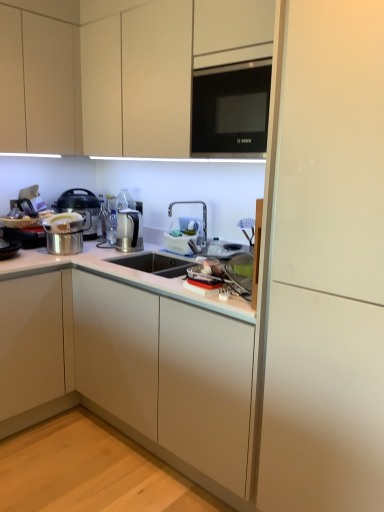
Question: Is white plastic basket at center to the right of black glass microwave at upper center from the viewer's perspective?

Choices:
 (A) no
 (B) yes

Answer: (A)

Question: Does white plastic basket at center have a smaller size compared to black glass microwave at upper center?

Choices:
 (A) yes
 (B) no

Answer: (A)

Question: From the image's perspective, is white plastic basket at center on top of black glass microwave at upper center?

Choices:
 (A) no
 (B) yes

Answer: (A)

Question: Can you confirm if white plastic basket at center is shorter than black glass microwave at upper center?

Choices:
 (A) yes
 (B) no

Answer: (A)

Question: From a real-world perspective, is white plastic basket at center located beneath black glass microwave at upper center?

Choices:
 (A) no
 (B) yes

Answer: (B)

Question: Is black glass microwave at upper center inside white plastic basket at center?

Choices:
 (A) yes
 (B) no

Answer: (B)

Question: Is metallic silver pressure cooker at left far away from white matte cabinet at right?

Choices:
 (A) no
 (B) yes

Answer: (B)

Question: Does metallic silver pressure cooker at left have a larger size compared to white matte cabinet at right?

Choices:
 (A) no
 (B) yes

Answer: (A)

Question: Is metallic silver pressure cooker at left not within white matte cabinet at right?

Choices:
 (A) no
 (B) yes

Answer: (B)

Question: Can you confirm if metallic silver pressure cooker at left is thinner than white matte cabinet at right?

Choices:
 (A) yes
 (B) no

Answer: (A)

Question: From a real-world perspective, is metallic silver pressure cooker at left positioned over white matte cabinet at right based on gravity?

Choices:
 (A) no
 (B) yes

Answer: (B)

Question: Is metallic silver pressure cooker at left wider than white matte cabinet at right?

Choices:
 (A) yes
 (B) no

Answer: (B)

Question: From the image's perspective, is black glass microwave at upper center below white glossy cabinet at center, which appears as the 1th cabinetry when ordered from the bottom?

Choices:
 (A) yes
 (B) no

Answer: (B)